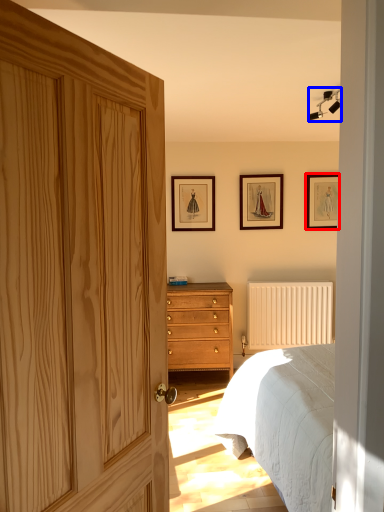
Question: Which object is further to the camera taking this photo, picture frame (highlighted by a red box) or light fixture (highlighted by a blue box)?

Choices:
 (A) picture frame
 (B) light fixture

Answer: (A)